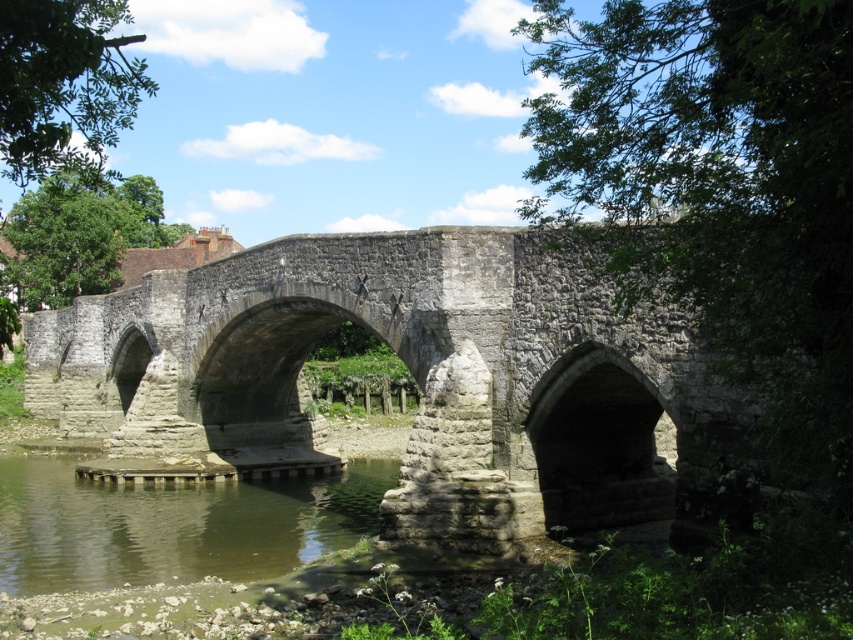
Who is lower down, stone bridge at center or green murky water at lower left?

green murky water at lower left is below.

Which is above, stone bridge at center or green murky water at lower left?

stone bridge at center is higher up.

Who is more forward, (91, 340) or (61, 460)?

Point (61, 460)

Where is `stone bridge at center`? stone bridge at center is located at coordinates (415, 378).